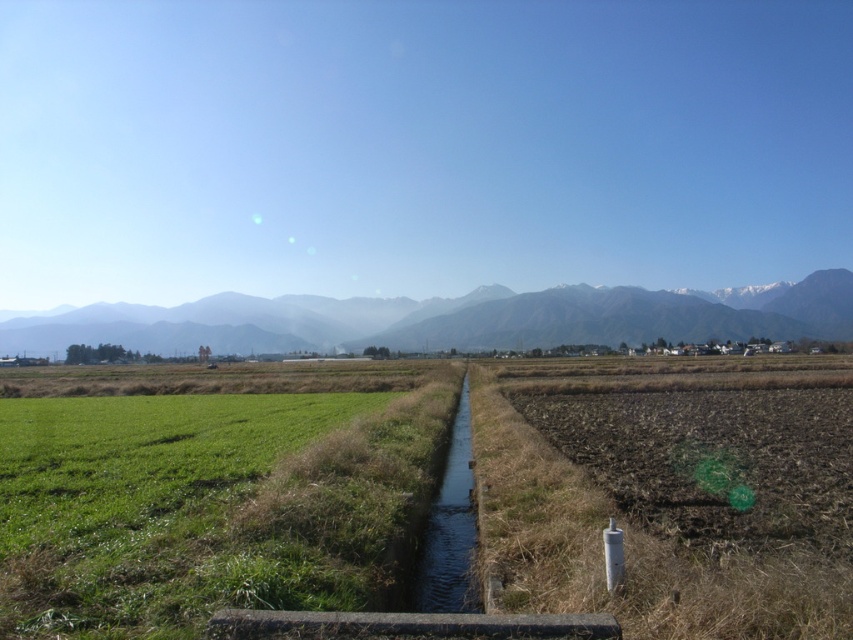
Question: From the image, what is the correct spatial relationship of green grass at lower left in relation to clear water at center?

Choices:
 (A) below
 (B) above

Answer: (B)

Question: Can you confirm if green grassy farmland at center is smaller than grayish-brown mountain range at center?

Choices:
 (A) no
 (B) yes

Answer: (B)

Question: Which of the following is the closest to the observer?

Choices:
 (A) clear water at center
 (B) grayish-brown mountain range at center
 (C) green grassy farmland at center

Answer: (C)

Question: Which point is closer to the camera?

Choices:
 (A) (10, 500)
 (B) (837, 289)
 (C) (471, 504)

Answer: (A)

Question: Does green grass at lower left appear on the left side of grayish-brown mountain range at center?

Choices:
 (A) yes
 (B) no

Answer: (A)

Question: Which object is positioned closest to the grayish-brown mountain range at center?

Choices:
 (A) green grass at lower left
 (B) clear water at center
 (C) green grassy farmland at center

Answer: (C)